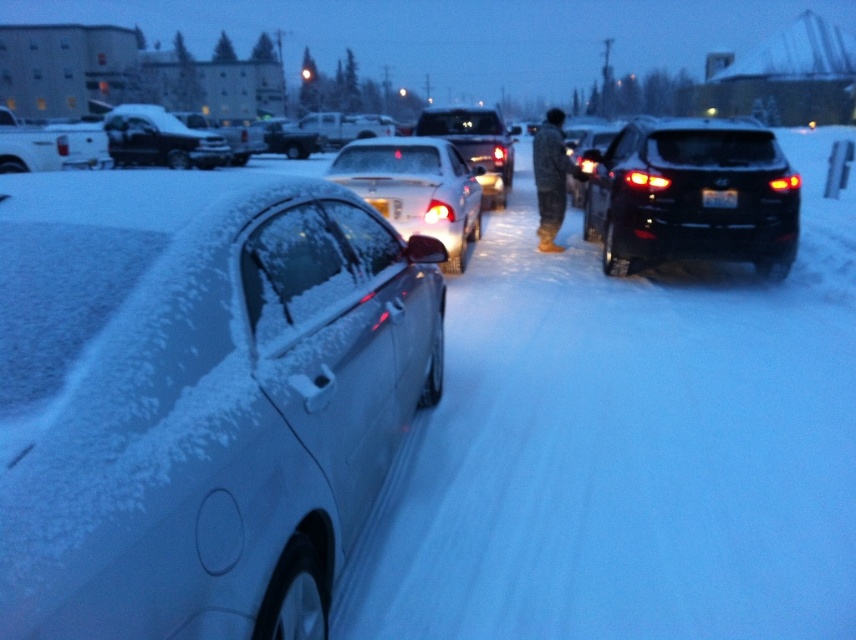
Question: Does white matte car at left have a smaller size compared to white glossy sedan at center?

Choices:
 (A) yes
 (B) no

Answer: (A)

Question: Among these points, which one is nearest to the camera?

Choices:
 (A) (711, 164)
 (B) (461, 195)

Answer: (A)

Question: Is white glossy sedan at center thinner than camouflage fabric jacket at center?

Choices:
 (A) no
 (B) yes

Answer: (A)

Question: In this image, where is white glossy sedan at center located relative to matte black truck at center?

Choices:
 (A) right
 (B) left

Answer: (B)

Question: Which object is positioned farthest from the white matte car at left?

Choices:
 (A) white glossy sedan at center
 (B) snow-covered suv at left

Answer: (B)

Question: Which of the following is the closest to the observer?

Choices:
 (A) matte black truck at center
 (B) white matte car at left

Answer: (B)